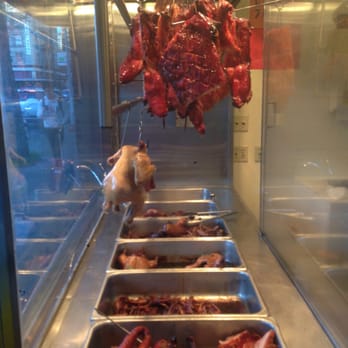
Identify the location of silver metallic panels. (208, 147), (310, 195).